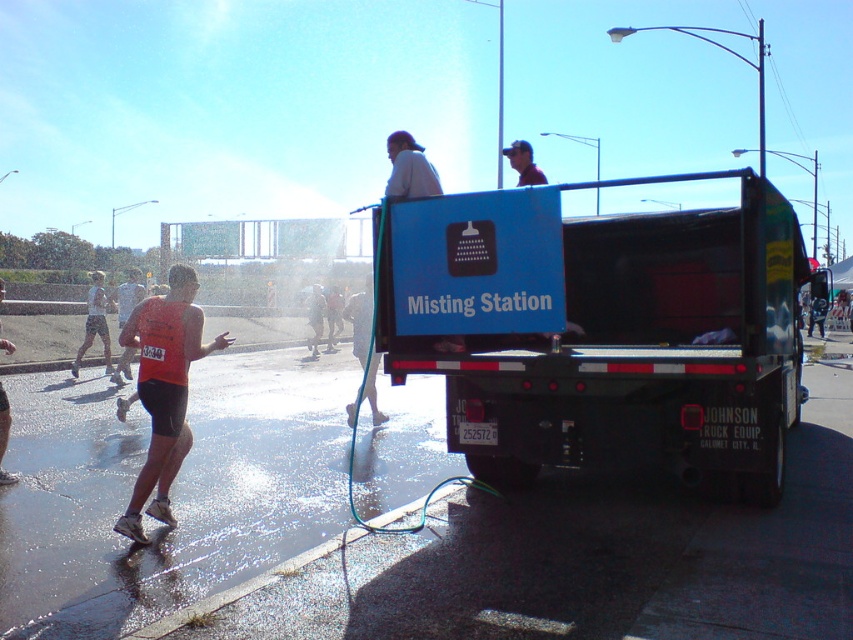
You are a photographer positioned at the starting line of the marathon. You want to capture a photo that includes both the blue matte truck at upper center and the orange tank top at left. Given their sizes, which object should you focus on first to ensure both fit in the frame?

The blue matte truck at upper center is larger in width than the orange tank top at left, so you should focus on including the blue matte truck at upper center first to ensure both fit in the frame.

From the picture: You are a photographer at the marathon event. You need to capture a photo where both the blue matte truck at upper center and the orange tank top at left are visible. Considering their sizes, which object should you focus on to ensure both are in frame without cropping?

The blue matte truck at upper center is larger in size than the orange tank top at left, so you should focus on the blue matte truck at upper center to ensure both are in frame without cropping, as it requires more space.

You are a runner in a marathon and you see a misting station. You want to check if your shorts are orange. Your shorts are at point (164, 388). Is the fabric at that point orange?

The point (164, 388) is on orange fabric shorts at left, so yes, the fabric at that point is orange.